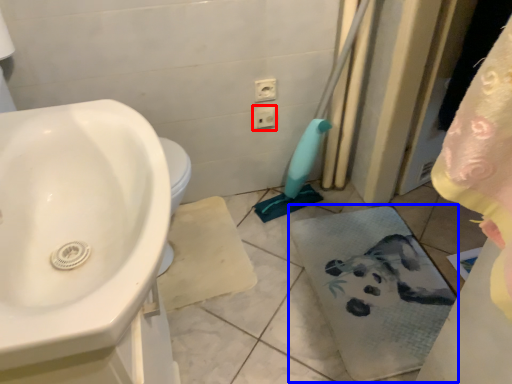
Question: Which object appears closest to the camera in this image, electric outlet (highlighted by a red box) or bath towel (highlighted by a blue box)?

Choices:
 (A) electric outlet
 (B) bath towel

Answer: (B)